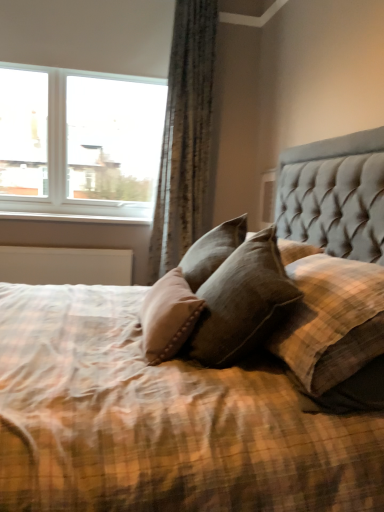
Question: Can you confirm if textured gray curtain at upper left is smaller than brown textured pillow at center?

Choices:
 (A) yes
 (B) no

Answer: (B)

Question: From the image's perspective, is textured gray curtain at upper left on brown textured pillow at center?

Choices:
 (A) yes
 (B) no

Answer: (A)

Question: Can you confirm if textured gray curtain at upper left is thinner than brown textured pillow at center?

Choices:
 (A) no
 (B) yes

Answer: (B)

Question: From a real-world perspective, is textured gray curtain at upper left over brown textured pillow at center?

Choices:
 (A) no
 (B) yes

Answer: (B)

Question: Is the depth of textured gray curtain at upper left less than that of brown textured pillow at center?

Choices:
 (A) no
 (B) yes

Answer: (A)

Question: Does textured gray curtain at upper left have a larger size compared to brown textured pillow at center?

Choices:
 (A) no
 (B) yes

Answer: (B)

Question: Is brown textured pillow at center shorter than textured gray curtain at upper left?

Choices:
 (A) no
 (B) yes

Answer: (B)

Question: Considering the relative positions of brown textured pillow at center and textured gray curtain at upper left in the image provided, is brown textured pillow at center to the left of textured gray curtain at upper left from the viewer's perspective?

Choices:
 (A) yes
 (B) no

Answer: (B)

Question: Is brown textured pillow at center next to textured gray curtain at upper left?

Choices:
 (A) yes
 (B) no

Answer: (B)

Question: Considering the relative sizes of brown textured pillow at center and textured gray curtain at upper left in the image provided, is brown textured pillow at center smaller than textured gray curtain at upper left?

Choices:
 (A) yes
 (B) no

Answer: (A)

Question: Is brown textured pillow at center positioned in front of textured gray curtain at upper left?

Choices:
 (A) no
 (B) yes

Answer: (B)

Question: Would you say brown textured pillow at center contains textured gray curtain at upper left?

Choices:
 (A) no
 (B) yes

Answer: (A)

Question: Does white glass window at upper left have a lesser width compared to brown textured pillow at center?

Choices:
 (A) yes
 (B) no

Answer: (A)